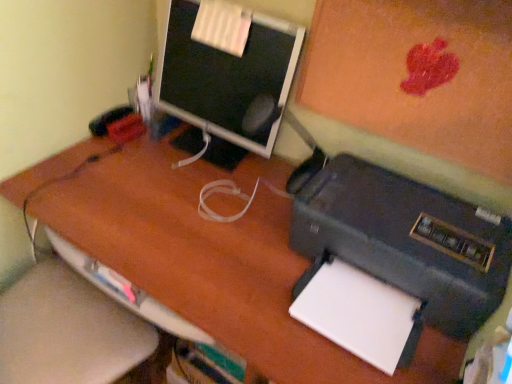
Find the location of a particular element. The image size is (512, 384). vacant space to the left of matte black monitor at upper center is located at coordinates (131, 156).